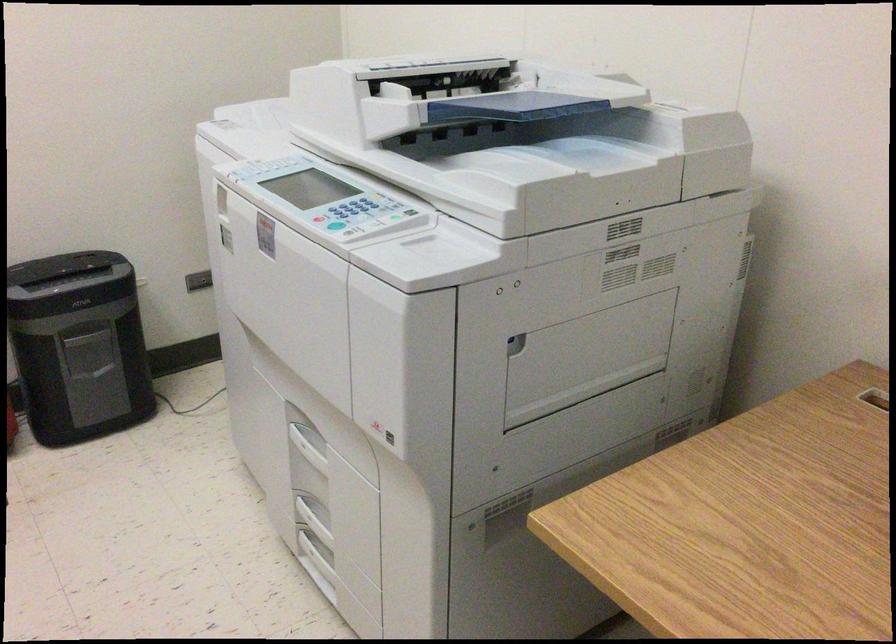
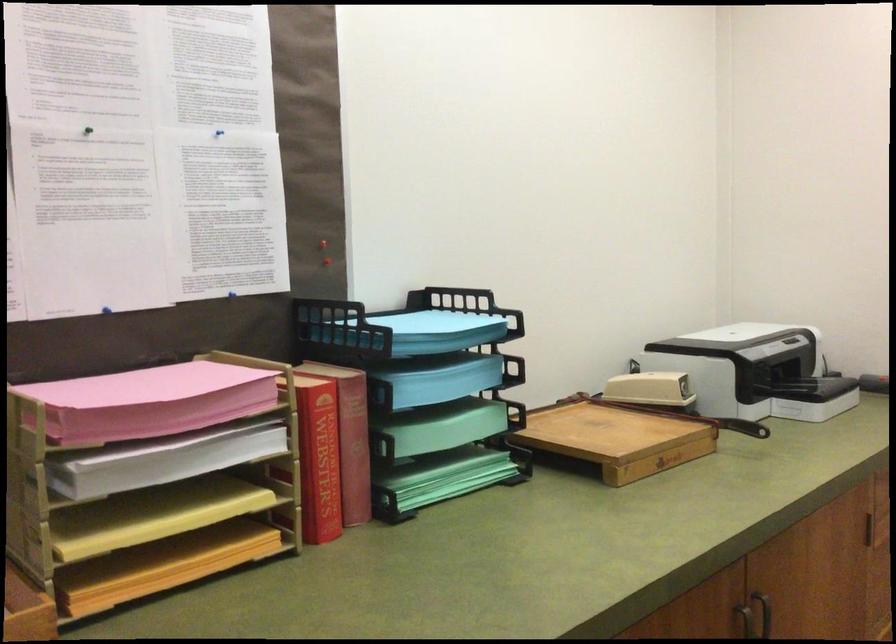
Question: Based on the continuous images, in which direction is the camera rotating? Reply with the corresponding letter.

Choices:
 (A) Left
 (B) Right
 (C) Up
 (D) Down

Answer: (A)